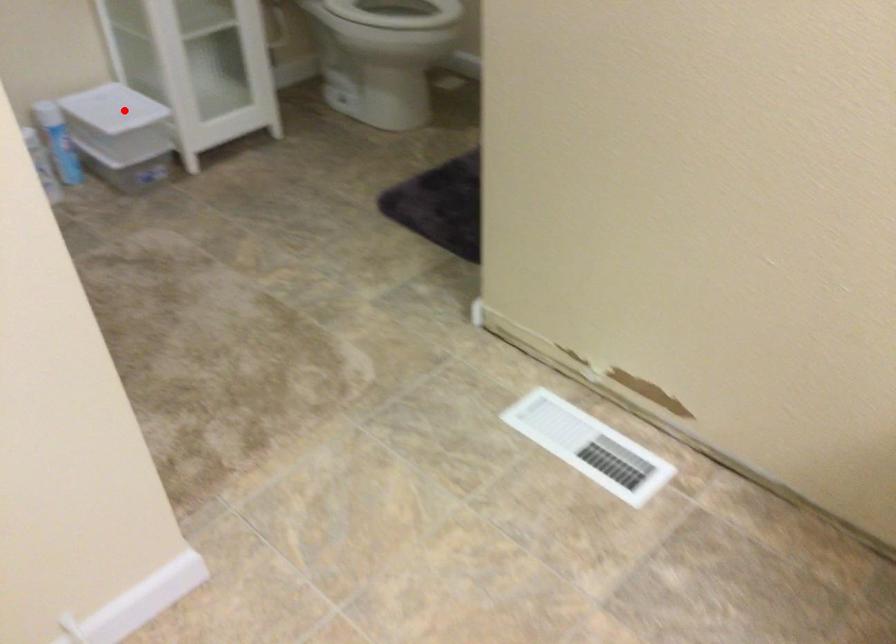
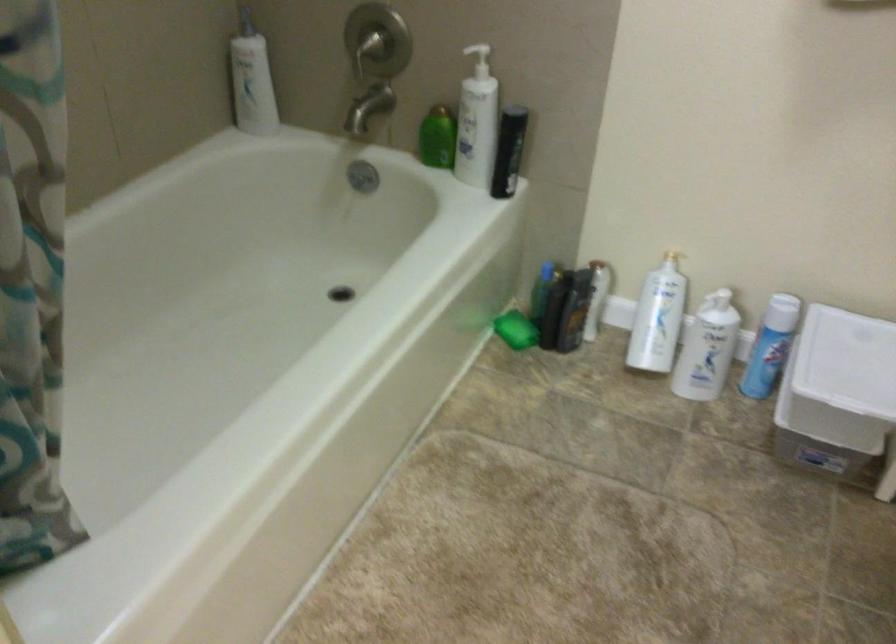
The point at the highlighted location is marked in the first image. Where is the corresponding point in the second image?

(847, 361)